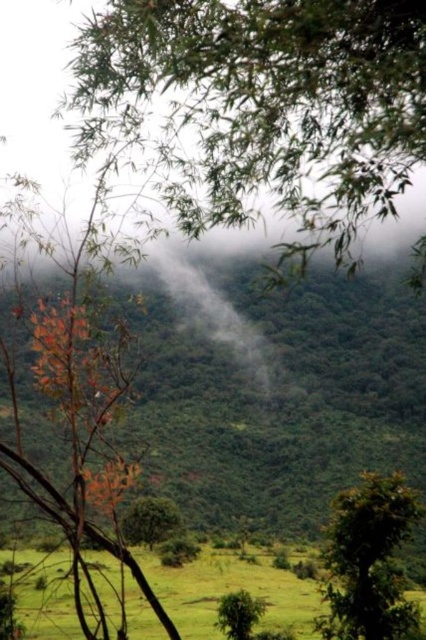
Question: Which point is farther from the camera taking this photo?

Choices:
 (A) (344, 563)
 (B) (170, 108)
 (C) (245, 614)

Answer: (C)

Question: Considering the real-world distances, which object is farthest from the green grassy field at lower center?

Choices:
 (A) green matte tree at lower center
 (B) green matte tree at center
 (C) green matte tree at lower right
 (D) green leafy tree at upper center

Answer: (C)

Question: Which of these objects is positioned farthest from the green matte tree at lower right?

Choices:
 (A) green grassy field at lower center
 (B) green matte tree at lower center
 (C) green matte tree at center
 (D) green leafy tree at upper center

Answer: (D)

Question: Where is green grassy field at lower center located in relation to green matte tree at lower right in the image?

Choices:
 (A) right
 (B) left

Answer: (B)

Question: Does green leafy tree at upper center appear over green matte tree at center?

Choices:
 (A) no
 (B) yes

Answer: (B)

Question: Can you confirm if green matte tree at center is positioned above green matte tree at lower center?

Choices:
 (A) yes
 (B) no

Answer: (A)